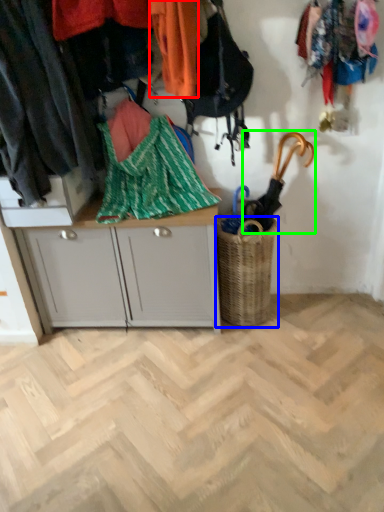
Question: Which is nearer to the clothing (highlighted by a red box)? basket (highlighted by a blue box) or umbrella (highlighted by a green box).

Choices:
 (A) basket
 (B) umbrella

Answer: (B)